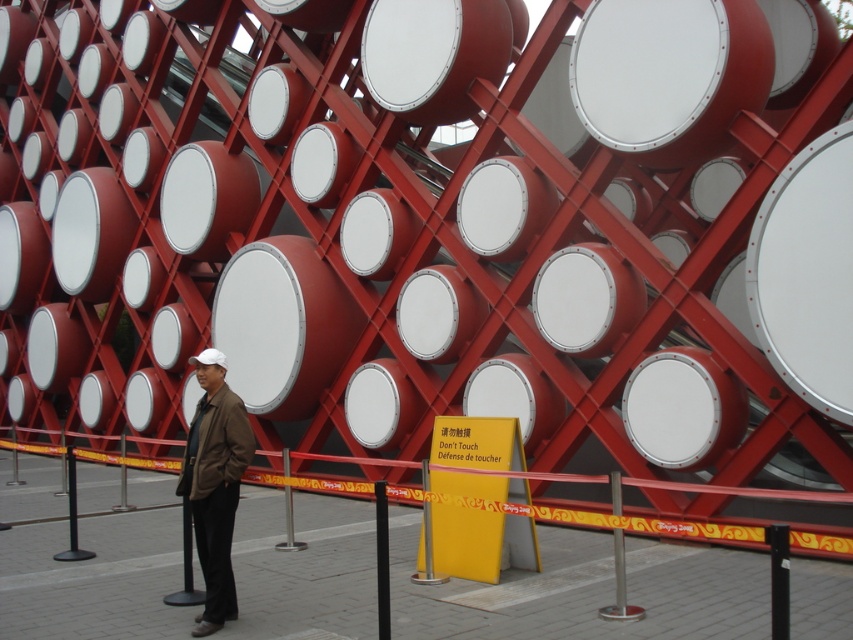
You are a photographer trying to capture both the brown leather jacket at center and the white matte drum at center in a single frame. Which object should you focus on first to ensure both are in the frame?

The brown leather jacket at center is larger than the white matte drum at center, so focusing on the larger object first will help ensure both fit within the frame.

You are a photographer trying to capture the man in the brown leather jacket at center in your shot. The camera is positioned at the origin point. What direction should you move the camera to focus on the jacket?

The brown leather jacket at center is located at point coordinates of 0.756 on the x axis and 0.252 on the y axis. Since the camera is at the origin point, you should move the camera to the right along the x axis and slightly upwards along the y axis to focus on the jacket.